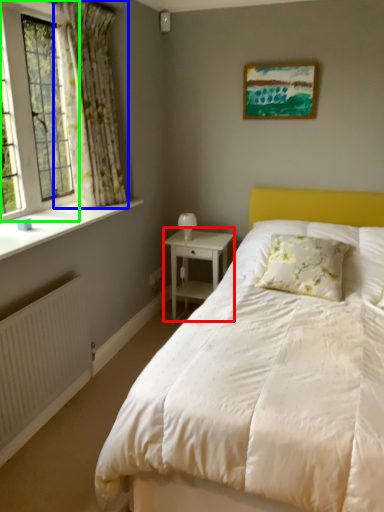
Question: Based on their relative distances, which object is farther from nightstand (highlighted by a red box)? Choose from curtain (highlighted by a blue box) and window (highlighted by a green box).

Choices:
 (A) curtain
 (B) window

Answer: (B)